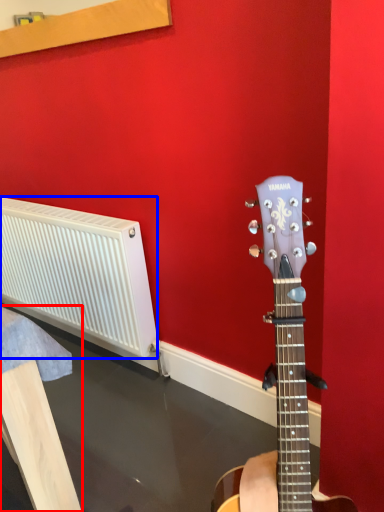
Question: Which point is further to the camera, furniture (highlighted by a red box) or radiator (highlighted by a blue box)?

Choices:
 (A) furniture
 (B) radiator

Answer: (B)